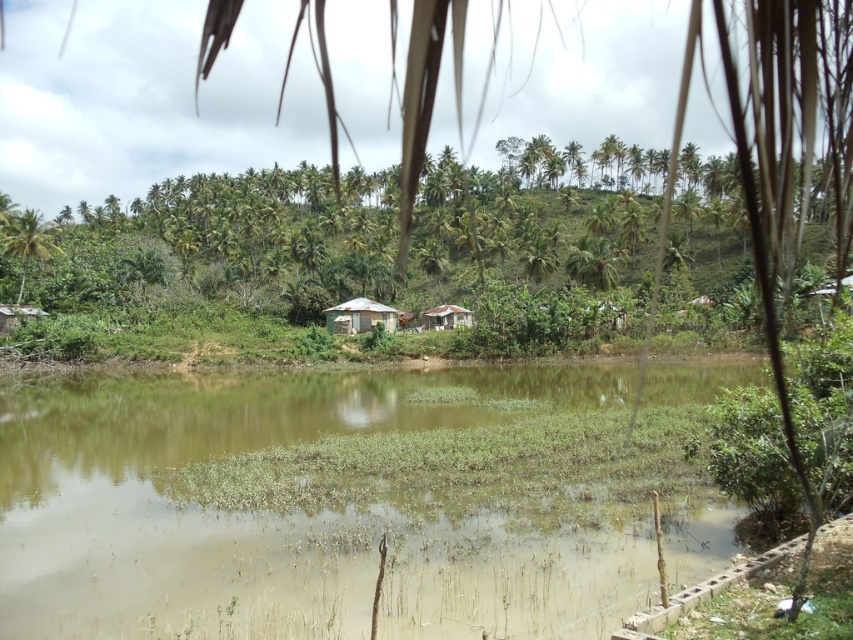
Is point (109, 588) positioned after point (33, 225)?

No.

Between brown muddy water at center and green leafy palm tree at left, which one appears on the left side from the viewer's perspective?

green leafy palm tree at left

Is point (561, 522) closer to viewer compared to point (3, 236)?

Yes, point (561, 522) is in front of point (3, 236).

Identify the location of brown muddy water at center. The image size is (853, 640). (303, 513).

Can you confirm if green leafy palm tree at left is positioned to the right of green corrugated metal hut at center?

In fact, green leafy palm tree at left is to the left of green corrugated metal hut at center.

Between point (38, 243) and point (376, 308), which one is positioned behind?

The point (376, 308) is more distant.

Where is `green leafy palm tree at left`? green leafy palm tree at left is located at coordinates (28, 241).

Can you confirm if green leafy palm tree at left is wider than rusty corrugated metal hut at center?

Yes, green leafy palm tree at left is wider than rusty corrugated metal hut at center.

Who is shorter, green leafy palm tree at left or rusty corrugated metal hut at center?

rusty corrugated metal hut at center

This screenshot has height=640, width=853. Describe the element at coordinates (28, 241) in the screenshot. I see `green leafy palm tree at left` at that location.

Locate an element on the screen. The height and width of the screenshot is (640, 853). green leafy palm tree at left is located at coordinates (28, 241).